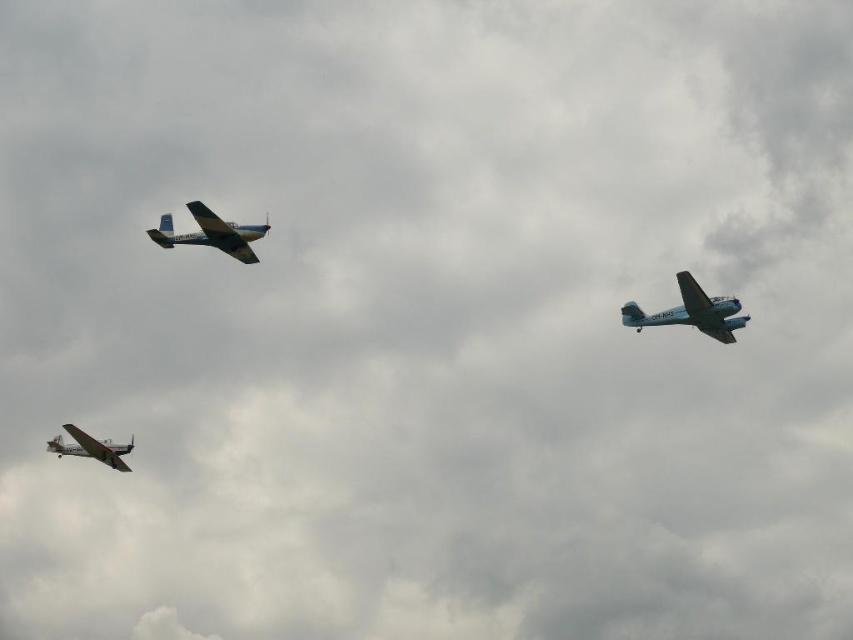
Which is behind, point (705, 328) or point (183, 243)?

The point (183, 243) is behind.

Who is higher up, light blue matte airplane at upper right or metallic blue airplane at upper left?

metallic blue airplane at upper left

The width and height of the screenshot is (853, 640). Find the location of `light blue matte airplane at upper right`. light blue matte airplane at upper right is located at coordinates pyautogui.click(x=691, y=310).

Is light blue matte airplane at upper right positioned before silver metallic airplane at lower left?

Yes, light blue matte airplane at upper right is in front of silver metallic airplane at lower left.

Between light blue matte airplane at upper right and silver metallic airplane at lower left, which one appears on the left side from the viewer's perspective?

From the viewer's perspective, silver metallic airplane at lower left appears more on the left side.

Describe the element at coordinates (691, 310) in the screenshot. The height and width of the screenshot is (640, 853). I see `light blue matte airplane at upper right` at that location.

This screenshot has width=853, height=640. Identify the location of light blue matte airplane at upper right. (691, 310).

Is point (204, 208) less distant than point (67, 445)?

Yes, point (204, 208) is in front of point (67, 445).

Can you confirm if metallic blue airplane at upper left is bigger than silver metallic airplane at lower left?

Yes.

Who is more forward, (x=193, y=241) or (x=114, y=444)?

Point (x=193, y=241) is more forward.

In order to click on metallic blue airplane at upper left in this screenshot , I will do `click(212, 234)`.